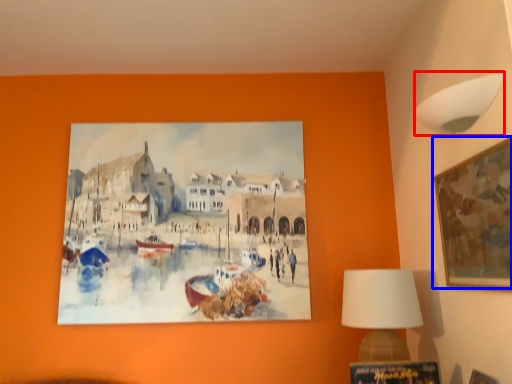
Question: Which object is closer to the camera taking this photo, lamp (highlighted by a red box) or picture frame (highlighted by a blue box)?

Choices:
 (A) lamp
 (B) picture frame

Answer: (B)